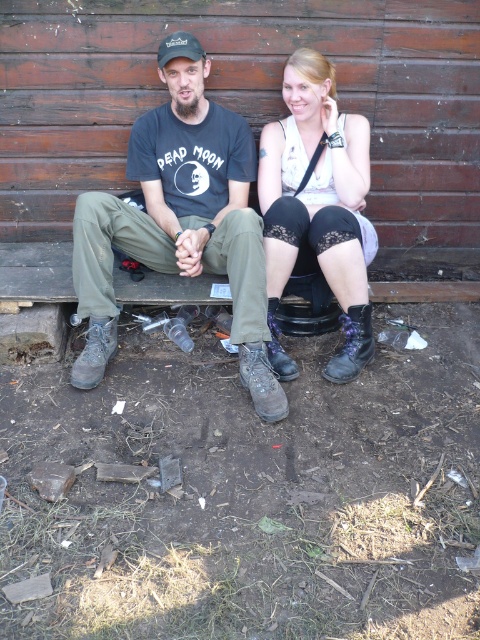
Question: Is matte black t-shirt at center below matte white tank top at center?

Choices:
 (A) yes
 (B) no

Answer: (A)

Question: Does matte black t-shirt at center have a lesser width compared to matte white tank top at center?

Choices:
 (A) yes
 (B) no

Answer: (B)

Question: Among these objects, which one is nearest to the camera?

Choices:
 (A) matte white tank top at center
 (B) matte black t-shirt at center

Answer: (B)

Question: Is the position of matte black t-shirt at center more distant than that of matte white tank top at center?

Choices:
 (A) no
 (B) yes

Answer: (A)